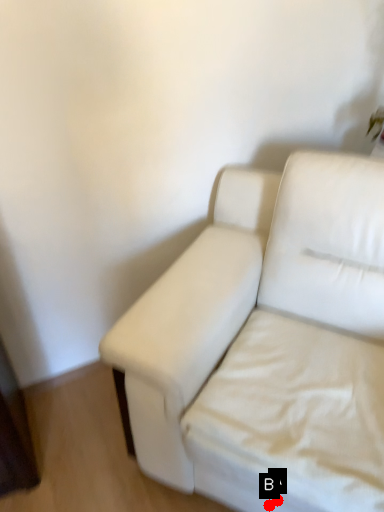
Question: Two points are circled on the image, labeled by A and B beside each circle. Which point appears closest to the camera in this image?

Choices:
 (A) A is closer
 (B) B is closer

Answer: (A)